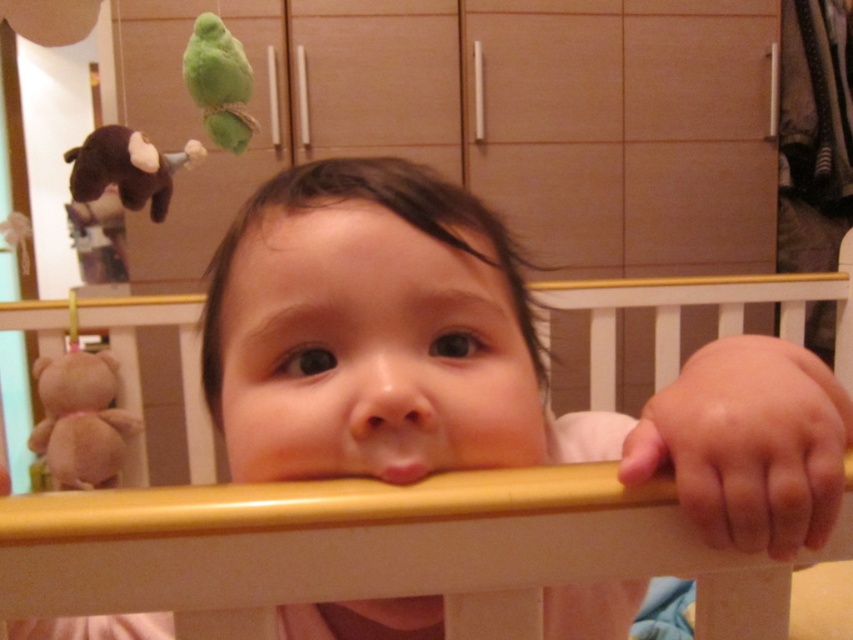
You are a parent checking on your baby. You see the wooden crib at center and the brown plush monkey at left. Which object is bigger?

The wooden crib at center is larger in size than the brown plush monkey at left.

You are a parent checking the nursery. You see the brown plush bear at left and the green plush parrot at upper left. Which toy is positioned lower in the scene?

The brown plush bear at left is located below the green plush parrot at upper left, so the brown plush bear at left is positioned lower in the scene.

You are a photographer taking a picture of the baby in the crib. You notice the brown plush bear at left and the pink matte mouth at center in your frame. Which object appears bigger in the photo?

The brown plush bear at left appears bigger in the photo because it has a larger size compared to the pink matte mouth at center.